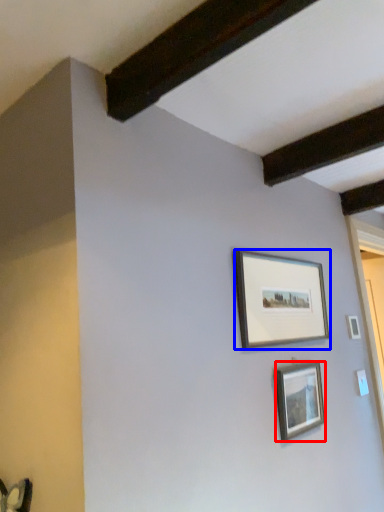
Question: Which of the following is the closest to the observer, picture frame (highlighted by a red box) or picture frame (highlighted by a blue box)?

Choices:
 (A) picture frame
 (B) picture frame

Answer: (B)